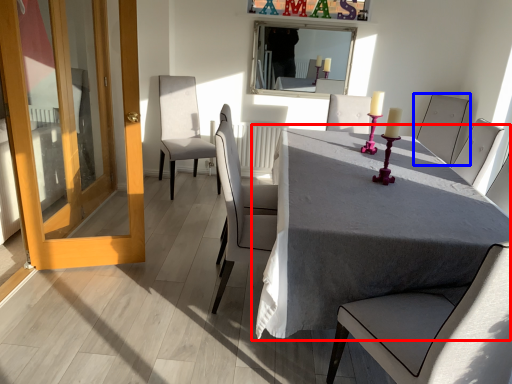
Question: Which object appears closest to the camera in this image, table (highlighted by a red box) or chair (highlighted by a blue box)?

Choices:
 (A) table
 (B) chair

Answer: (A)